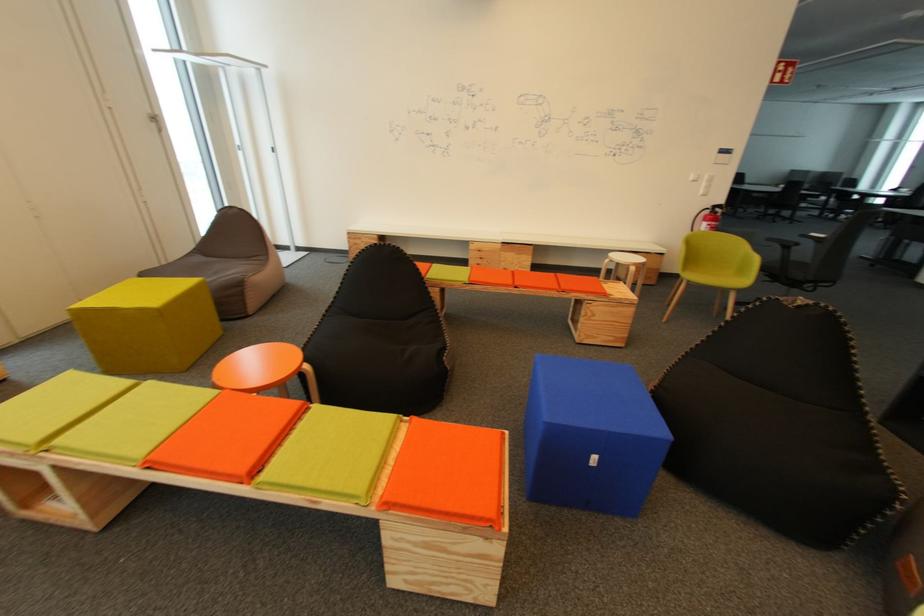
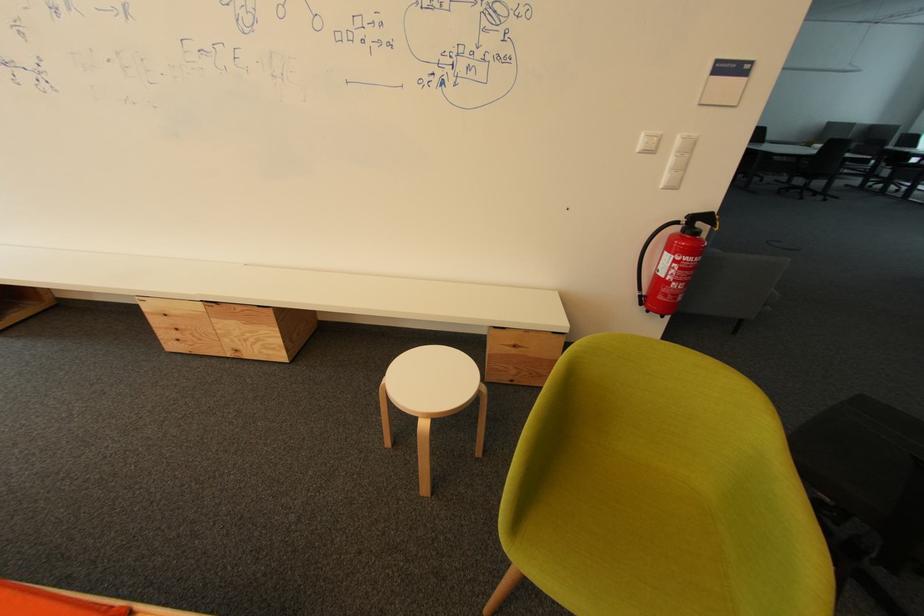
Consider the image. What movement of the cameraman would produce the second image?

The cameraman moved toward right, forward.